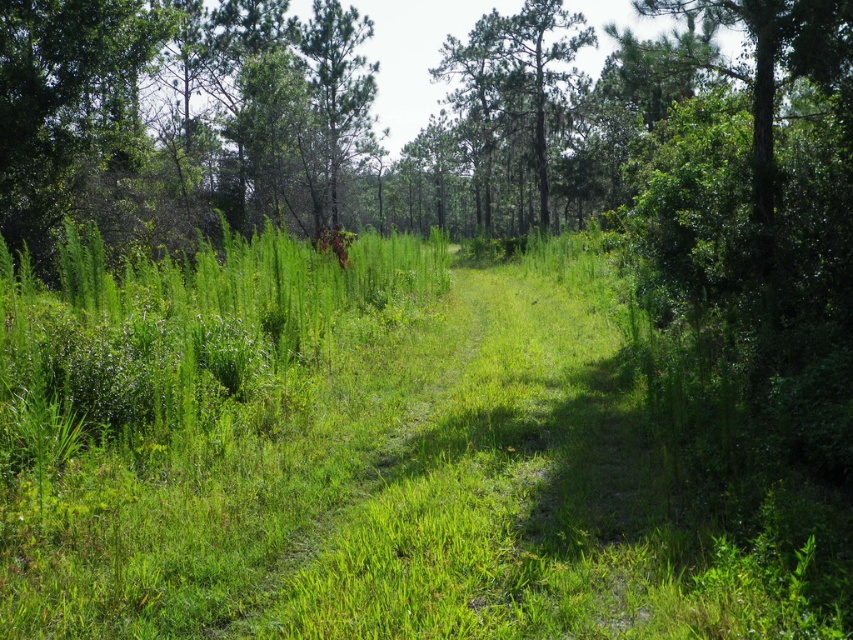
This screenshot has height=640, width=853. What are the coordinates of `green leafy tree at center` in the screenshot? It's located at (514, 83).

Which is in front, point (535, 13) or point (311, 88)?

Point (311, 88) is in front.

Find the location of a particular element. The height and width of the screenshot is (640, 853). green leafy tree at center is located at coordinates (514, 83).